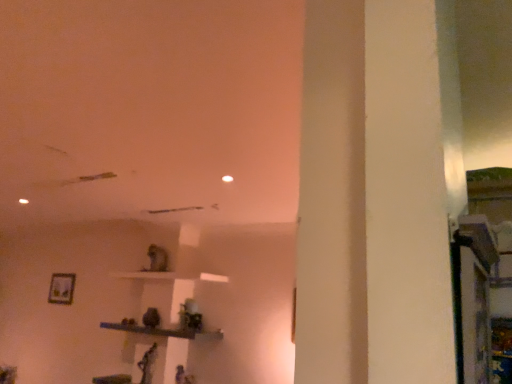
Question: Does point (130, 324) appear closer or farther from the camera than point (65, 302)?

Choices:
 (A) closer
 (B) farther

Answer: (A)

Question: Considering the positions of wooden shelf at center and matte silver picture frame at lower left in the image, is wooden shelf at center bigger or smaller than matte silver picture frame at lower left?

Choices:
 (A) small
 (B) big

Answer: (B)

Question: From the image's perspective, relative to matte silver picture frame at lower left, is wooden shelf at center above or below?

Choices:
 (A) below
 (B) above

Answer: (A)

Question: Considering their positions, is matte silver picture frame at lower left located in front of or behind wooden shelf at center?

Choices:
 (A) behind
 (B) front

Answer: (A)

Question: From the image's perspective, is matte silver picture frame at lower left above or below wooden shelf at center?

Choices:
 (A) above
 (B) below

Answer: (A)

Question: Is matte silver picture frame at lower left wider or thinner than wooden shelf at center?

Choices:
 (A) wide
 (B) thin

Answer: (B)

Question: From their relative heights in the image, would you say matte silver picture frame at lower left is taller or shorter than wooden shelf at center?

Choices:
 (A) tall
 (B) short

Answer: (A)